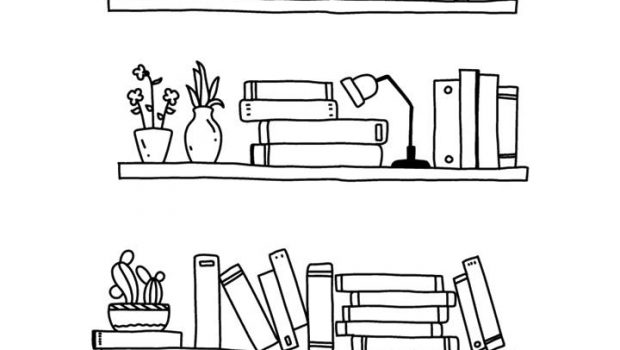
The height and width of the screenshot is (350, 620). Identify the location of books laid sideways. (397, 345), (388, 328), (384, 316), (390, 298), (390, 285), (312, 157), (312, 134), (290, 109), (288, 86), (126, 334).